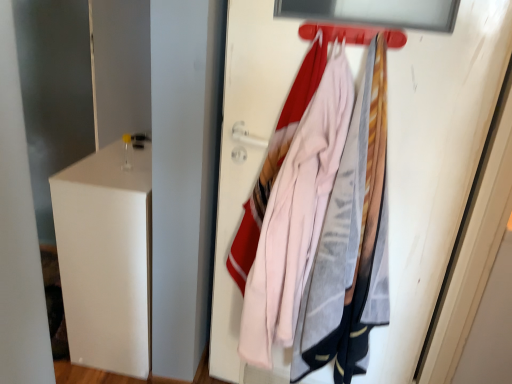
Question: Would you consider metallic red hanger at upper center to be distant from pink fabric coat at center?

Choices:
 (A) yes
 (B) no

Answer: (B)

Question: Can you confirm if metallic red hanger at upper center is wider than pink fabric coat at center?

Choices:
 (A) no
 (B) yes

Answer: (A)

Question: From a real-world perspective, is metallic red hanger at upper center located higher than pink fabric coat at center?

Choices:
 (A) yes
 (B) no

Answer: (A)

Question: Would you say pink fabric coat at center is part of metallic red hanger at upper center's contents?

Choices:
 (A) yes
 (B) no

Answer: (B)

Question: From a real-world perspective, is metallic red hanger at upper center under pink fabric coat at center?

Choices:
 (A) no
 (B) yes

Answer: (A)

Question: Is metallic red hanger at upper center facing towards pink fabric coat at center?

Choices:
 (A) yes
 (B) no

Answer: (B)

Question: From a real-world perspective, does pink fabric at upper right stand above white matte file cabinet at left?

Choices:
 (A) yes
 (B) no

Answer: (A)

Question: Does pink fabric at upper right have a smaller size compared to white matte file cabinet at left?

Choices:
 (A) yes
 (B) no

Answer: (A)

Question: From the image's perspective, is pink fabric at upper right under white matte file cabinet at left?

Choices:
 (A) no
 (B) yes

Answer: (A)

Question: Considering the relative sizes of pink fabric at upper right and white matte file cabinet at left in the image provided, is pink fabric at upper right taller than white matte file cabinet at left?

Choices:
 (A) yes
 (B) no

Answer: (A)

Question: Is pink fabric at upper right next to white matte file cabinet at left and touching it?

Choices:
 (A) no
 (B) yes

Answer: (A)

Question: Does pink fabric at upper right lie behind white matte file cabinet at left?

Choices:
 (A) yes
 (B) no

Answer: (B)

Question: Considering the relative sizes of pink fabric coat at center and pink fabric at upper right in the image provided, is pink fabric coat at center smaller than pink fabric at upper right?

Choices:
 (A) yes
 (B) no

Answer: (A)